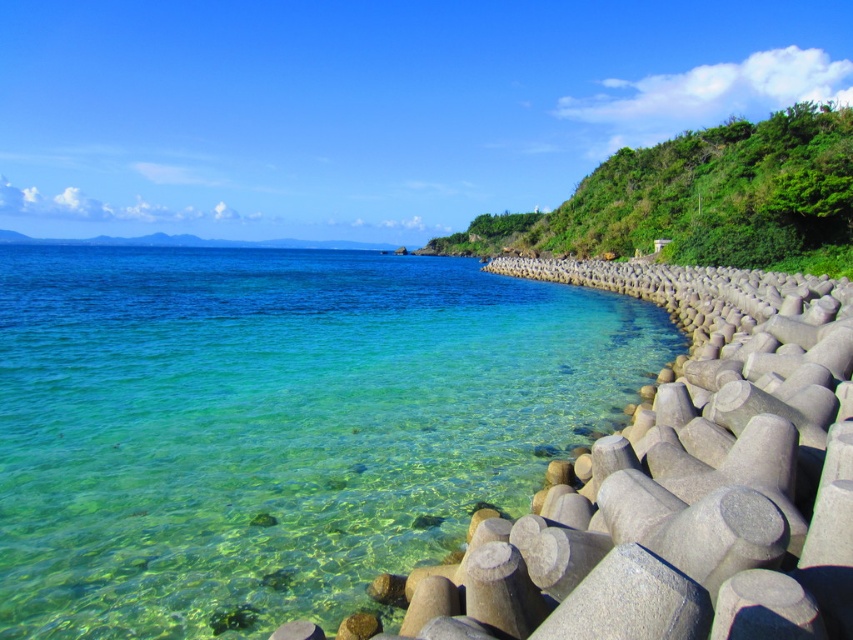
Question: Which of the following is the closest to the observer?

Choices:
 (A) clear water at lower left
 (B) green leafy hillside at upper right

Answer: (A)

Question: Considering the relative positions of clear water at lower left and green leafy hillside at upper right in the image provided, where is clear water at lower left located with respect to green leafy hillside at upper right?

Choices:
 (A) below
 (B) above

Answer: (A)

Question: Is clear water at lower left wider than green leafy hillside at upper right?

Choices:
 (A) no
 (B) yes

Answer: (B)

Question: In this image, where is clear water at lower left located relative to green leafy hillside at upper right?

Choices:
 (A) above
 (B) below

Answer: (B)